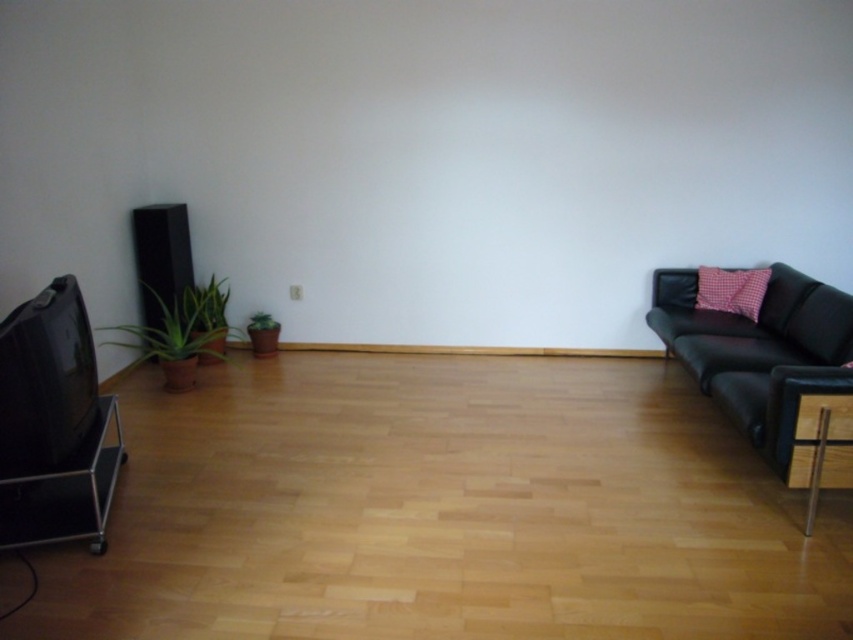
This screenshot has height=640, width=853. Describe the element at coordinates (759, 353) in the screenshot. I see `black leather couch at right` at that location.

Is black leather couch at right closer to the viewer compared to pink checkered pillow at right?

Yes.

Describe the element at coordinates (759, 353) in the screenshot. I see `black leather couch at right` at that location.

Image resolution: width=853 pixels, height=640 pixels. I want to click on black leather couch at right, so click(759, 353).

Is green matte plant at left bigger than green matte plant at lower left?

Yes.

Is green matte plant at left above green matte plant at lower left?

Incorrect, green matte plant at left is not positioned above green matte plant at lower left.

Image resolution: width=853 pixels, height=640 pixels. In order to click on green matte plant at left in this screenshot , I will do `click(177, 333)`.

Is green matte plant at left bigger than pink checkered pillow at right?

Correct, green matte plant at left is larger in size than pink checkered pillow at right.

Between green matte plant at left and pink checkered pillow at right, which one has less height?

pink checkered pillow at right is shorter.

At what (x,y) coordinates should I click in order to perform the action: click on green matte plant at left. Please return your answer as a coordinate pair (x, y). Looking at the image, I should click on pyautogui.click(x=177, y=333).

Find the location of a particular element. The image size is (853, 640). green matte plant at left is located at coordinates (177, 333).